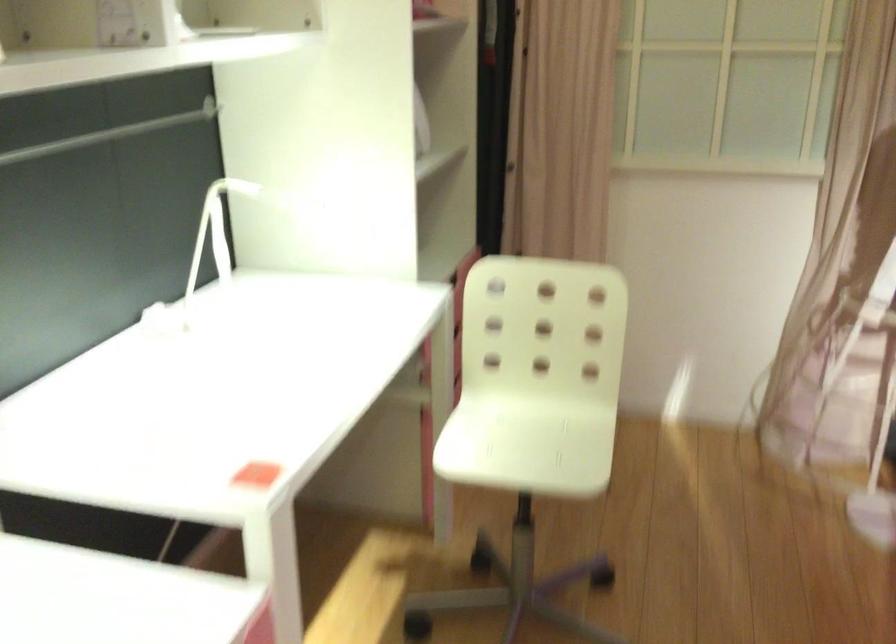
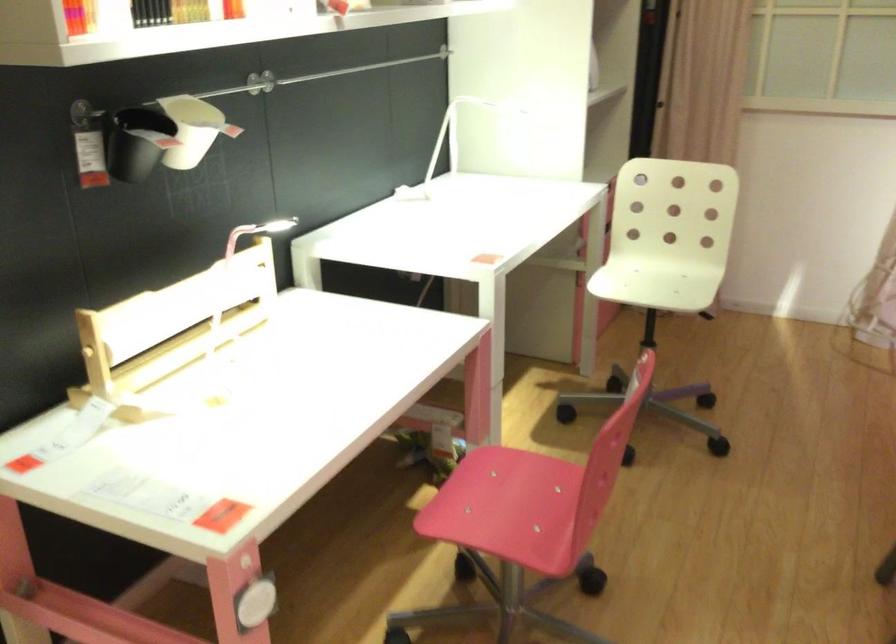
Where in the second image is the point corresponding to [538,424] from the first image?

(668, 277)